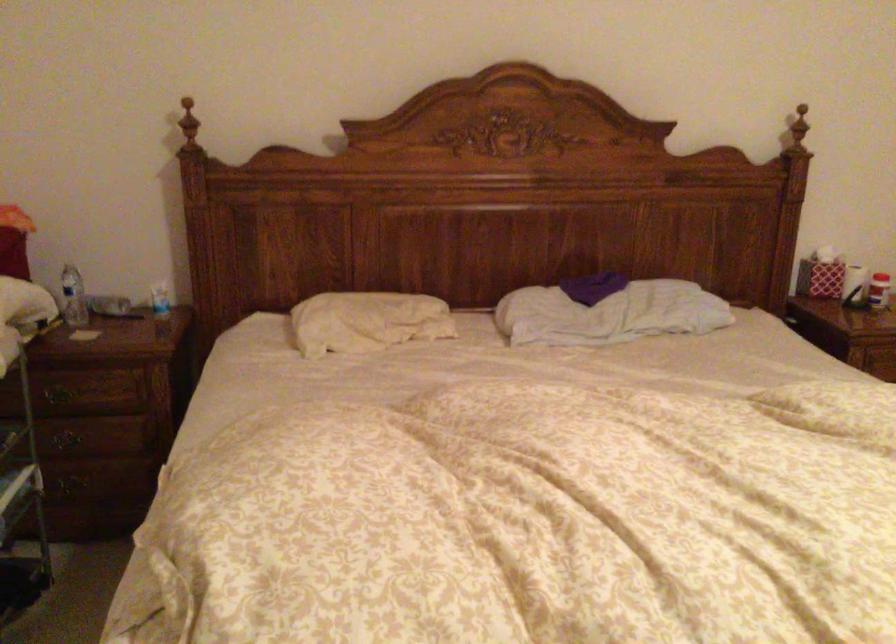
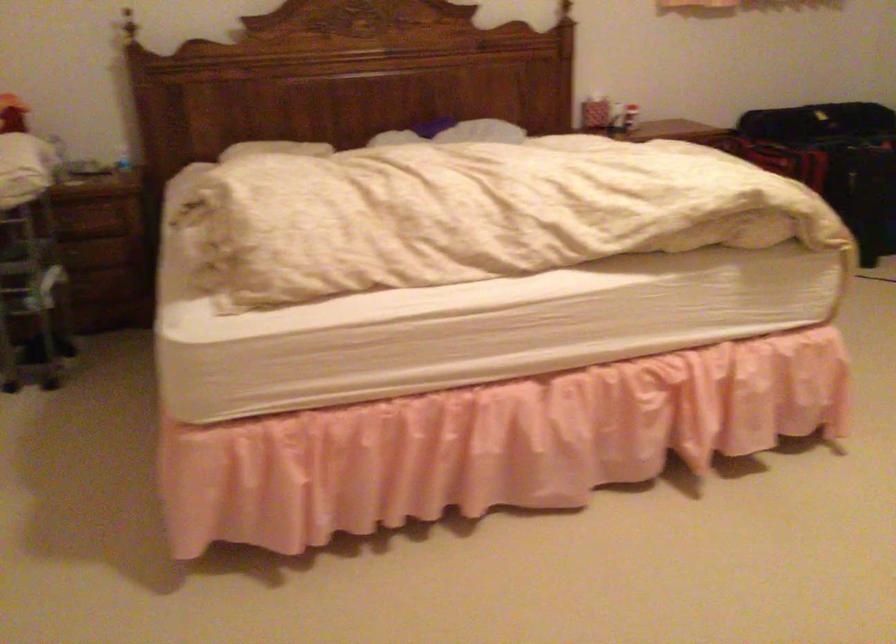
Question: In a continuous first-person perspective shot, in which direction is the camera moving?

Choices:
 (A) Left
 (B) Right
 (C) Forward
 (D) Backward

Answer: (D)